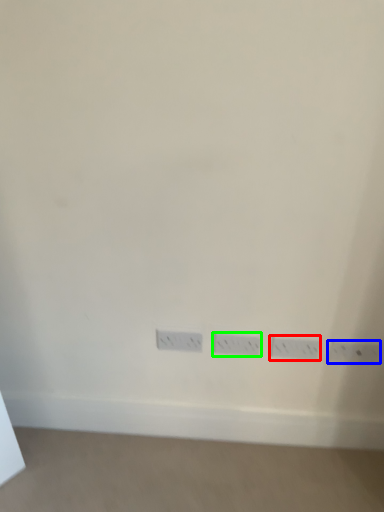
Question: Based on their relative distances, which object is nearer to power plugs and sockets (highlighted by a red box)? Choose from power plugs and sockets (highlighted by a blue box) and power plugs and sockets (highlighted by a green box).

Choices:
 (A) power plugs and sockets
 (B) power plugs and sockets

Answer: (A)